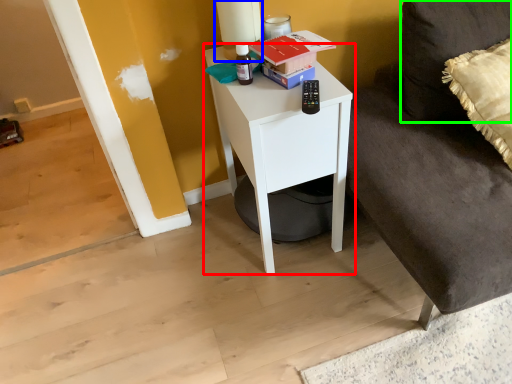
Question: Considering the real-world distances, which object is closest to nightstand (highlighted by a red box)? table lamp (highlighted by a blue box) or pillow (highlighted by a green box).

Choices:
 (A) table lamp
 (B) pillow

Answer: (A)